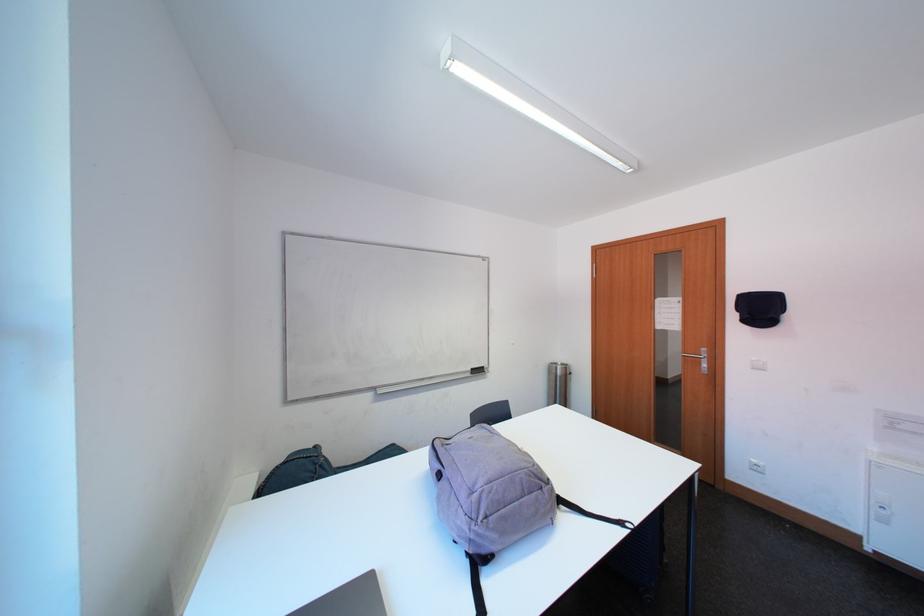
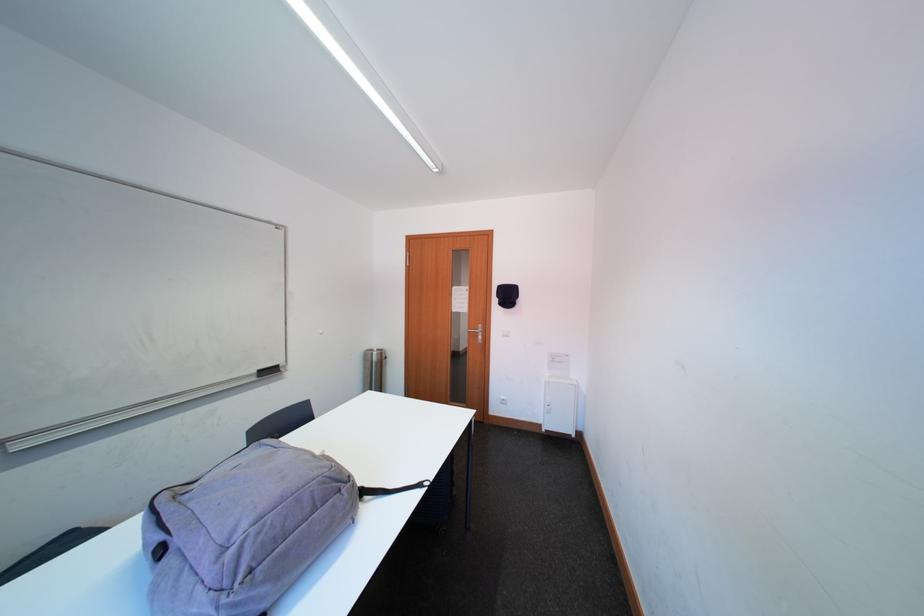
In the second image, find the point that corresponds to [868,541] in the first image.

(551, 429)